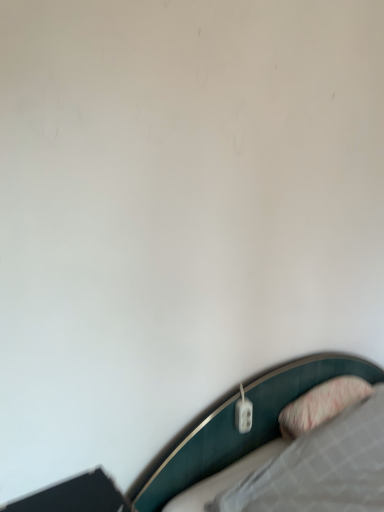
The height and width of the screenshot is (512, 384). What do you see at coordinates (322, 404) in the screenshot? I see `pink textured pillow at lower right` at bounding box center [322, 404].

Locate an element on the screen. The image size is (384, 512). pink textured pillow at lower right is located at coordinates (322, 404).

The width and height of the screenshot is (384, 512). Describe the element at coordinates (243, 415) in the screenshot. I see `white plastic electric outlet at lower right` at that location.

The width and height of the screenshot is (384, 512). What are the coordinates of `white plastic electric outlet at lower right` in the screenshot? It's located at (243, 415).

You are a GUI agent. You are given a task and a screenshot of the screen. Output one action in this format:
    pyautogui.click(x=<x>, y=<y>)
    Task: Click on the pink textured pillow at lower right
    Image resolution: width=384 pixels, height=512 pixels.
    Given the screenshot: What is the action you would take?
    pyautogui.click(x=322, y=404)

Which object is positioned more to the left, white plastic electric outlet at lower right or pink textured pillow at lower right?

white plastic electric outlet at lower right is more to the left.

Is white plastic electric outlet at lower right further to the viewer compared to pink textured pillow at lower right?

Yes, it is behind pink textured pillow at lower right.

Considering the positions of point (242, 420) and point (354, 382), is point (242, 420) closer or farther from the camera than point (354, 382)?

Point (242, 420) appears to be closer to the viewer than point (354, 382).

From the image's perspective, which one is positioned lower, white plastic electric outlet at lower right or pink textured pillow at lower right?

pink textured pillow at lower right, from the image's perspective.

From a real-world perspective, which is physically below, white plastic electric outlet at lower right or pink textured pillow at lower right?

In real-world perspective, pink textured pillow at lower right is lower.

Looking at this image, can you confirm if white plastic electric outlet at lower right is wider than pink textured pillow at lower right?

In fact, white plastic electric outlet at lower right might be narrower than pink textured pillow at lower right.

Considering the sizes of white plastic electric outlet at lower right and pink textured pillow at lower right in the image, is white plastic electric outlet at lower right taller or shorter than pink textured pillow at lower right?

In the image, white plastic electric outlet at lower right appears to be shorter than pink textured pillow at lower right.

From the picture: Which of these two, white plastic electric outlet at lower right or pink textured pillow at lower right, is smaller?

white plastic electric outlet at lower right.

Is white plastic electric outlet at lower right spatially inside pink textured pillow at lower right, or outside of it?

white plastic electric outlet at lower right is outside pink textured pillow at lower right.

Is white plastic electric outlet at lower right touching pink textured pillow at lower right?

No, white plastic electric outlet at lower right is not touching pink textured pillow at lower right.

Could you tell me if white plastic electric outlet at lower right is facing pink textured pillow at lower right?

No, white plastic electric outlet at lower right is not oriented towards pink textured pillow at lower right.

Locate an element on the screen. The image size is (384, 512). pillow that appears on the right of white plastic electric outlet at lower right is located at coordinates (322, 404).

Considering the positions of objects pink textured pillow at lower right and white plastic electric outlet at lower right in the image provided, who is more to the left, pink textured pillow at lower right or white plastic electric outlet at lower right?

Positioned to the left is white plastic electric outlet at lower right.

In the image, is pink textured pillow at lower right positioned in front of or behind white plastic electric outlet at lower right?

Visually, pink textured pillow at lower right is located in front of white plastic electric outlet at lower right.

Between point (357, 382) and point (239, 426), which one is positioned behind?

Positioned behind is point (357, 382).

From the image's perspective, is pink textured pillow at lower right below white plastic electric outlet at lower right?

Correct, pink textured pillow at lower right appears lower than white plastic electric outlet at lower right in the image.

From a real-world perspective, is pink textured pillow at lower right positioned above or below white plastic electric outlet at lower right?

pink textured pillow at lower right is situated lower than white plastic electric outlet at lower right in the real world.

Is pink textured pillow at lower right wider or thinner than white plastic electric outlet at lower right?

Considering their sizes, pink textured pillow at lower right looks broader than white plastic electric outlet at lower right.

From the picture: Considering the relative sizes of pink textured pillow at lower right and white plastic electric outlet at lower right in the image provided, is pink textured pillow at lower right shorter than white plastic electric outlet at lower right?

Incorrect, the height of pink textured pillow at lower right does not fall short of that of white plastic electric outlet at lower right.

Is pink textured pillow at lower right bigger than white plastic electric outlet at lower right?

Indeed, pink textured pillow at lower right has a larger size compared to white plastic electric outlet at lower right.

Based on the photo, would you say pink textured pillow at lower right is outside white plastic electric outlet at lower right?

pink textured pillow at lower right lies outside white plastic electric outlet at lower right's area.

Would you say pink textured pillow at lower right is a long distance from white plastic electric outlet at lower right?

They are positioned close to each other.

Is pink textured pillow at lower right oriented towards white plastic electric outlet at lower right?

→ No, pink textured pillow at lower right is not aimed at white plastic electric outlet at lower right.

How different are the orientations of pink textured pillow at lower right and white plastic electric outlet at lower right in degrees?

There is a 13.5-degree angle between the facing directions of pink textured pillow at lower right and white plastic electric outlet at lower right.

Based on the photo, measure the distance from pink textured pillow at lower right to white plastic electric outlet at lower right.

They are 12.57 inches apart.

Find the location of a particular element. The width and height of the screenshot is (384, 512). electric outlet that appears behind the pink textured pillow at lower right is located at coordinates (243, 415).

This screenshot has width=384, height=512. I want to click on pillow beneath the white plastic electric outlet at lower right (from a real-world perspective), so coord(322,404).

At what (x,y) coordinates should I click in order to perform the action: click on electric outlet behind the pink textured pillow at lower right. Please return your answer as a coordinate pair (x, y). Looking at the image, I should click on (243, 415).